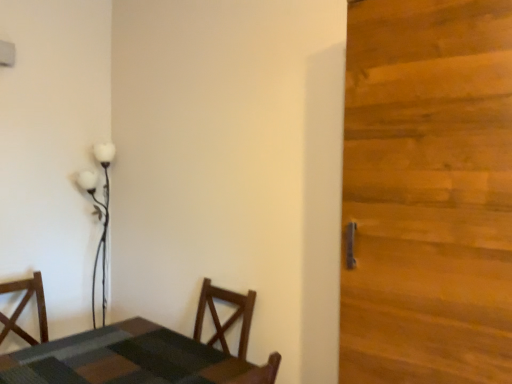
This screenshot has width=512, height=384. Find the location of `free spot above textured wood table at lower left (from a real-world perspective)`. free spot above textured wood table at lower left (from a real-world perspective) is located at coordinates (116, 345).